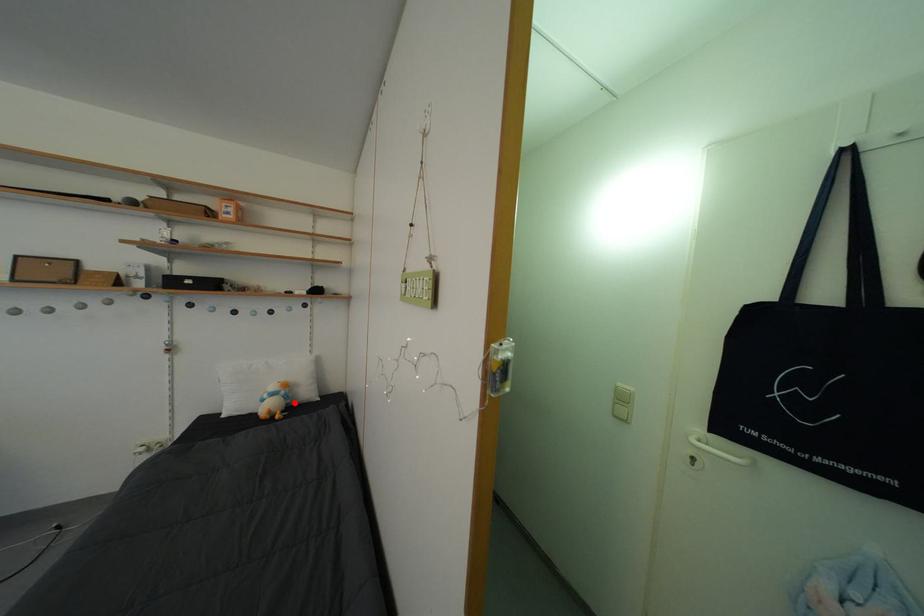
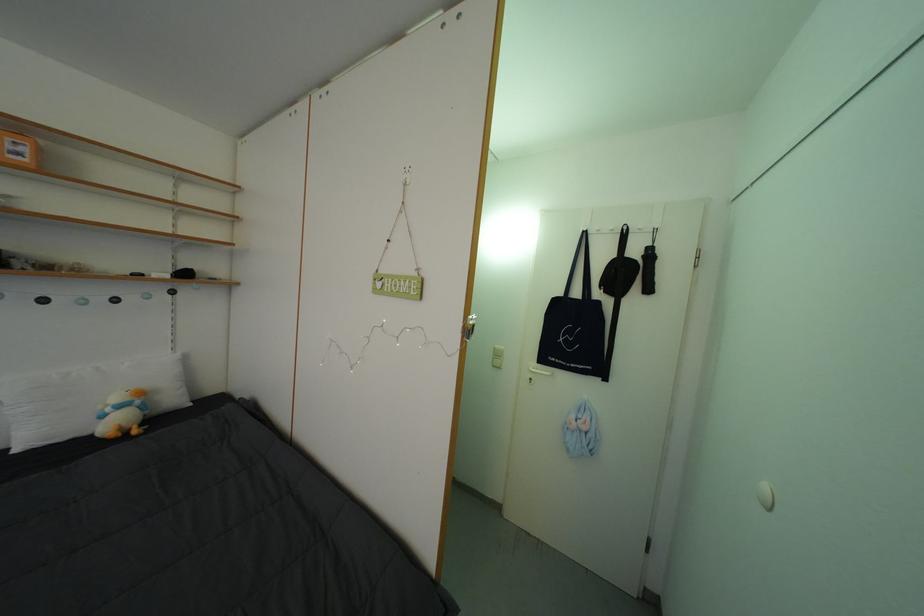
Locate, in the second image, the point that corresponds to the highlighted location in the first image.

(152, 413)